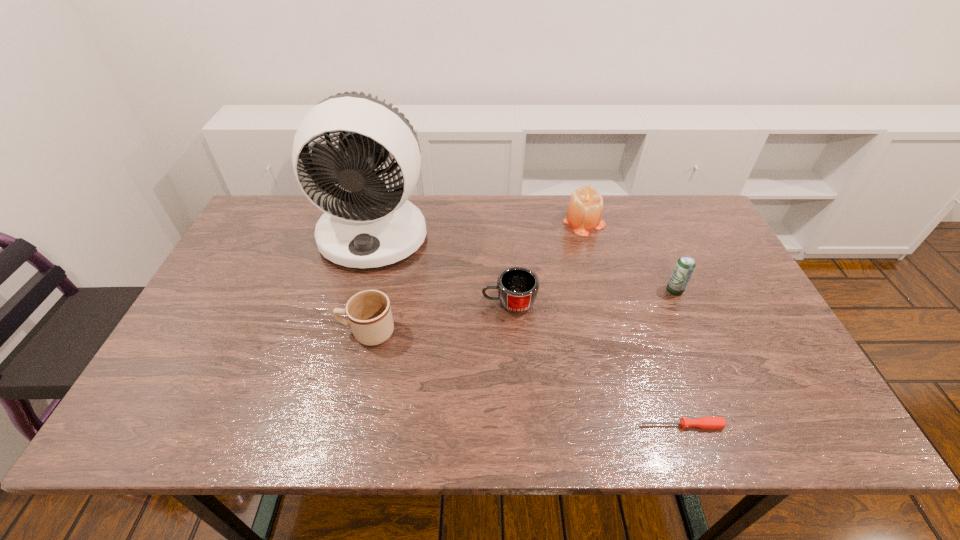
You are a GUI agent. You are given a task and a screenshot of the screen. Output one action in this format:
    pyautogui.click(x=<x>, y=<y>)
    Task: Click on the fan that is positioned at the far edge
    The height and width of the screenshot is (540, 960).
    Given the screenshot: What is the action you would take?
    pyautogui.click(x=366, y=226)

This screenshot has height=540, width=960. In order to click on candle located at the far edge in this screenshot , I will do `click(584, 212)`.

Where is `object that is at the near edge`? Image resolution: width=960 pixels, height=540 pixels. object that is at the near edge is located at coordinates (703, 422).

Where is `vacant space at the far edge of the desktop`? The height and width of the screenshot is (540, 960). vacant space at the far edge of the desktop is located at coordinates [527, 202].

Identify the location of free space at the near edge. (479, 411).

The height and width of the screenshot is (540, 960). In the image, there is a desktop. Identify the location of free space at the left edge. (203, 372).

You are a GUI agent. You are given a task and a screenshot of the screen. Output one action in this format:
    pyautogui.click(x=<x>, y=<y>)
    Task: Click on the vacant space at the right edge of the desktop
    
    Given the screenshot: What is the action you would take?
    pyautogui.click(x=670, y=242)

Locate an element on the screen. The width and height of the screenshot is (960, 540). free region at the far left corner of the desktop is located at coordinates (282, 208).

What are the coordinates of `free space between the beer can and the shortest object` in the screenshot? It's located at (678, 358).

The image size is (960, 540). What are the coordinates of `vacant area between the candle and the beer can` in the screenshot? It's located at (629, 256).